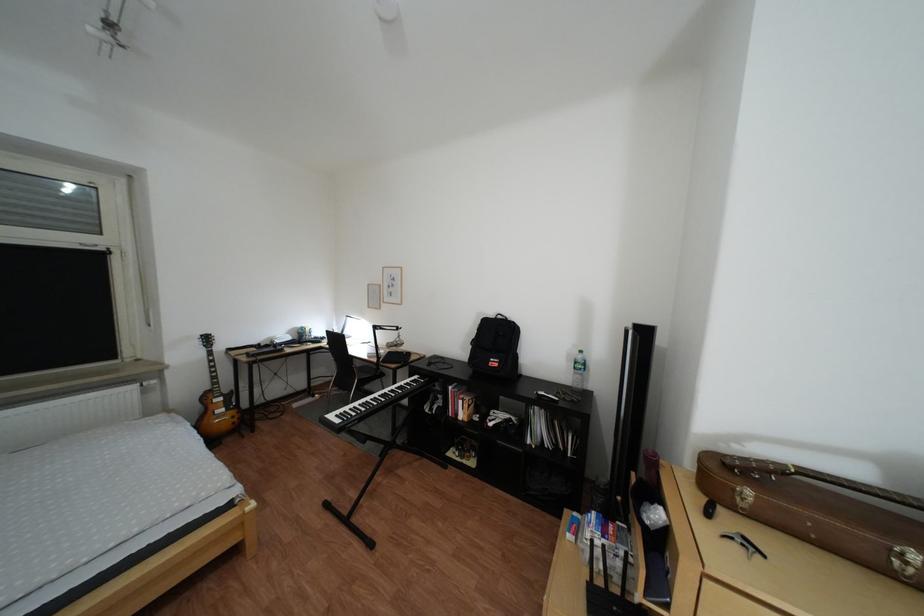
This screenshot has height=616, width=924. I want to click on brown guitar case, so click(x=819, y=512).